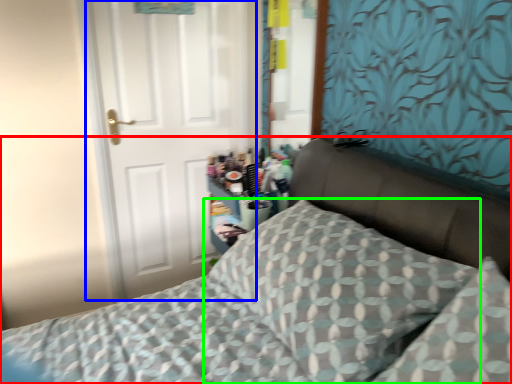
Question: Considering the real-world distances, which object is closest to bed (highlighted by a red box)? door (highlighted by a blue box) or pillow (highlighted by a green box).

Choices:
 (A) door
 (B) pillow

Answer: (B)